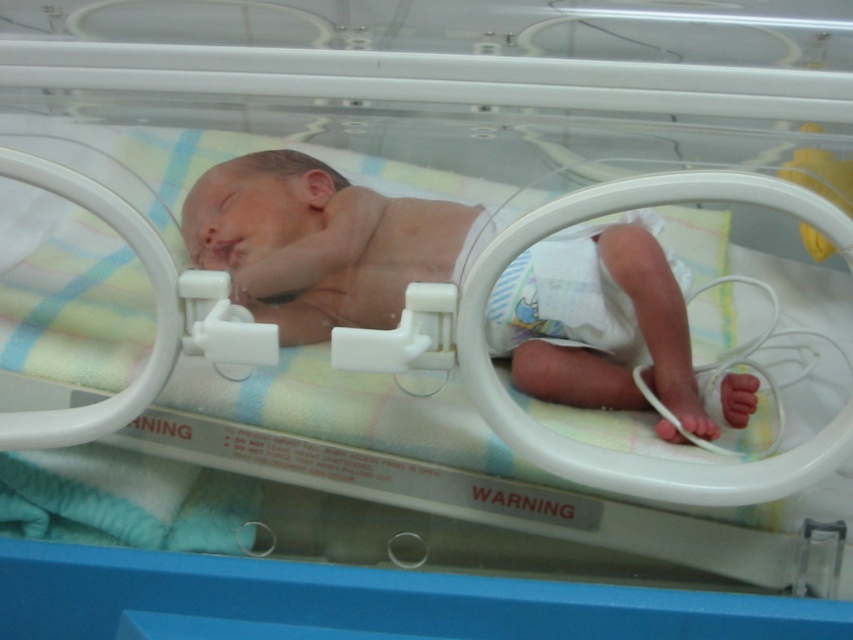
From the picture: You are a nurse checking the baby in the incubator. You need to ensure that the smooth skin newborn at center is positioned safely above the white cloth diaper at lower right. Is the newborn taller than the diaper?

The smooth skin newborn at center is taller than the white cloth diaper at lower right, so yes, the newborn is positioned safely above the diaper.

You are a nurse checking the baby in the incubator. You need to access the diaper. Which side of the smooth skin newborn at center should you approach to reach the white cloth diaper at lower right?

The white cloth diaper at lower right is located to the right side of the smooth skin newborn at center, so you should approach the right side of the smooth skin newborn at center to reach it.